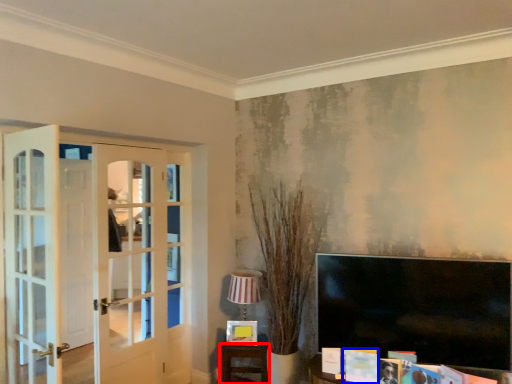
Question: Which point is closer to the camera, furniture (highlighted by a red box) or magazine (highlighted by a blue box)?

Choices:
 (A) furniture
 (B) magazine

Answer: (B)